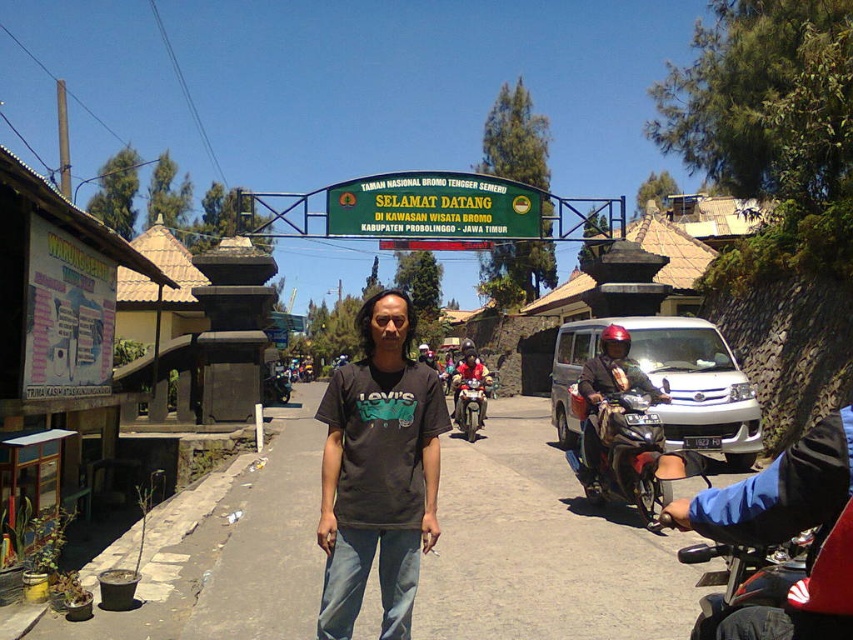
Does point (704, 355) come farther from viewer compared to point (583, 392)?

Yes.

Is point (724, 410) behind point (589, 422)?

Yes, point (724, 410) is behind point (589, 422).

The width and height of the screenshot is (853, 640). What are the coordinates of `silver metallic van at center-right` in the screenshot? It's located at (666, 384).

Is green plastic signboard at center below matte black helmet at upper center?

No, green plastic signboard at center is not below matte black helmet at upper center.

Between green plastic signboard at center and matte black helmet at upper center, which one is positioned lower?

matte black helmet at upper center is below.

Which is behind, point (497, 218) or point (595, 378)?

The point (497, 218) is behind.

Locate an element on the screen. Image resolution: width=853 pixels, height=640 pixels. green plastic signboard at center is located at coordinates (434, 208).

Does green plastic signboard at center have a larger size compared to metallic silver scooter at right?

Yes.

Who is more distant from viewer, (428, 236) or (598, 413)?

The point (428, 236) is behind.

Where is `green plastic signboard at center`? This screenshot has width=853, height=640. green plastic signboard at center is located at coordinates (434, 208).